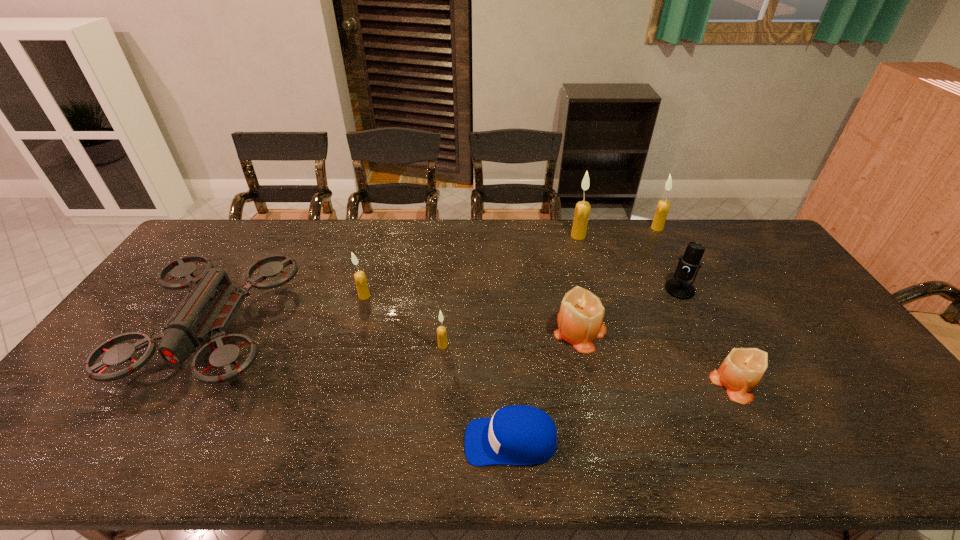
At what (x,y) coordinates should I click in order to perform the action: click on empty space between the second cream candle from right to left and the second biggest cream candle. Please return your answer as a coordinate pair (x, y). Image resolution: width=960 pixels, height=540 pixels. Looking at the image, I should click on (617, 232).

This screenshot has height=540, width=960. I want to click on free space between the bigger beige candle and the shortest object, so click(x=545, y=386).

Where is `vacant space that is in between the tallest candle and the third cream candle from right to left`? The width and height of the screenshot is (960, 540). vacant space that is in between the tallest candle and the third cream candle from right to left is located at coordinates (511, 291).

Locate an element on the screen. free space that is in between the eighth object from right to left and the fourth object from left to right is located at coordinates (438, 369).

The width and height of the screenshot is (960, 540). In order to click on vacant point located between the left beige candle and the third biggest cream candle in this screenshot , I will do `click(472, 313)`.

Locate an element on the screen. The width and height of the screenshot is (960, 540). object that is the seventh nearest to the leftmost object is located at coordinates (741, 371).

Point out which object is positioned as the fourth nearest to the tallest candle. Please provide its 2D coordinates. Your answer should be formatted as a tuple, i.e. [(x, y)], where the tuple contains the x and y coordinates of a point satisfying the conditions above.

[(741, 371)]

At what (x,y) coordinates should I click in order to perform the action: click on candle that is the closest to the nearest object. Please return your answer as a coordinate pair (x, y). Looking at the image, I should click on (580, 320).

Identify which candle is the third closest to the gray drone. Please provide its 2D coordinates. Your answer should be formatted as a tuple, i.e. [(x, y)], where the tuple contains the x and y coordinates of a point satisfying the conditions above.

[(580, 320)]

Identify the location of cream candle that is the third nearest to the smaller beige candle. (441, 330).